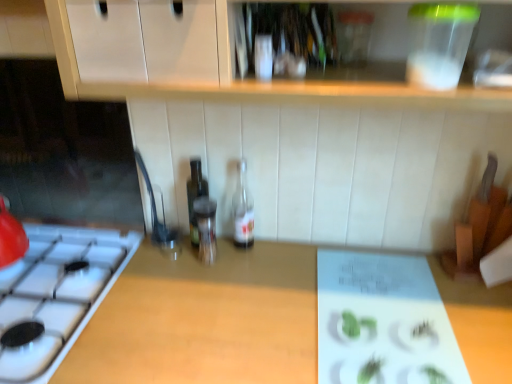
You are a GUI agent. You are given a task and a screenshot of the screen. Output one action in this format:
    pyautogui.click(x=<x>, y=<y>)
    Task: Click on the vacant space situated above wooden at center (from a real-world perspective)
    The height and width of the screenshot is (384, 512).
    Given the screenshot: What is the action you would take?
    pyautogui.click(x=328, y=315)